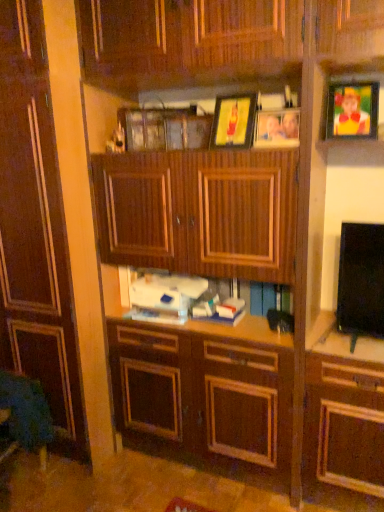
Question: From a real-world perspective, is wooden picture frame at upper center, the first picture frame viewed from the left, above or below dark wood cabinet at center?

Choices:
 (A) above
 (B) below

Answer: (A)

Question: Looking at the image, does wooden picture frame at upper center, the first picture frame viewed from the left, seem bigger or smaller compared to dark wood cabinet at center?

Choices:
 (A) big
 (B) small

Answer: (B)

Question: Which object is the closest to the matte plastic picture frame at upper right, the third picture frame from the left?

Choices:
 (A) wooden picture frame at upper center, which ranks as the second picture frame in right-to-left order
 (B) dark wood cabinet at center
 (C) wooden picture frame at upper center, acting as the 3th picture frame starting from the right

Answer: (A)

Question: Based on their relative distances, which object is farther from the dark wood cabinet at center?

Choices:
 (A) matte plastic picture frame at upper right, which is counted as the 1th picture frame, starting from the right
 (B) wooden picture frame at upper center, acting as the 3th picture frame starting from the right
 (C) wooden picture frame at upper center, arranged as the 2th picture frame when viewed from the left

Answer: (A)